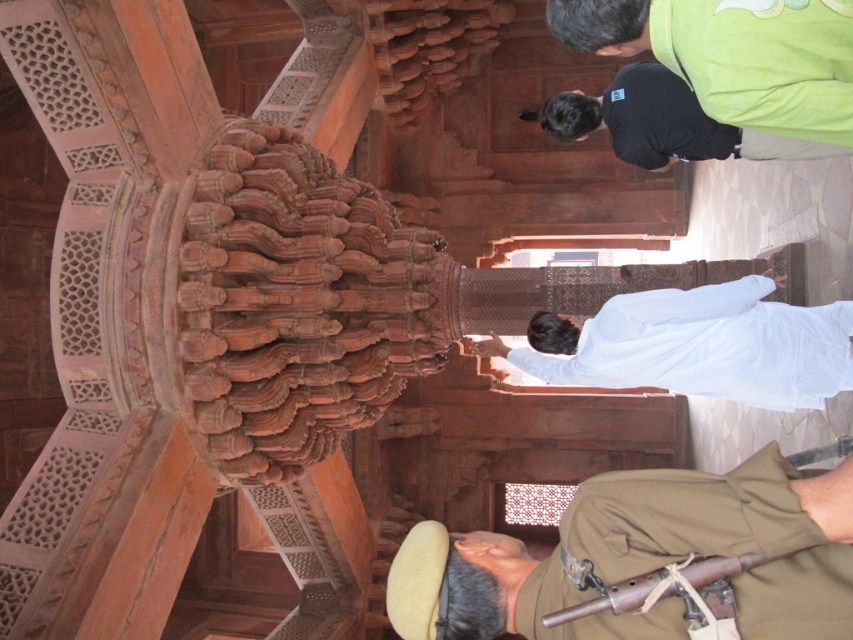
Is the position of khaki fabric at lower right more distant than that of white cotton shirt at center?

No, khaki fabric at lower right is closer to the viewer.

What do you see at coordinates (645, 561) in the screenshot? I see `khaki fabric at lower right` at bounding box center [645, 561].

This screenshot has width=853, height=640. What are the coordinates of `khaki fabric at lower right` in the screenshot? It's located at (645, 561).

Does point (677, 330) come in front of point (537, 115)?

Yes, it is in front of point (537, 115).

Between point (641, 332) and point (581, 93), which one is positioned in front?

Positioned in front is point (641, 332).

Which is behind, point (611, 308) or point (764, 147)?

The point (764, 147) is more distant.

I want to click on white cotton shirt at center, so coord(695,346).

Between point (695, 557) and point (576, 118), which one is positioned behind?

The point (576, 118) is behind.

What do you see at coordinates (645, 561) in the screenshot?
I see `khaki fabric at lower right` at bounding box center [645, 561].

The image size is (853, 640). What are the coordinates of `khaki fabric at lower right` in the screenshot? It's located at (645, 561).